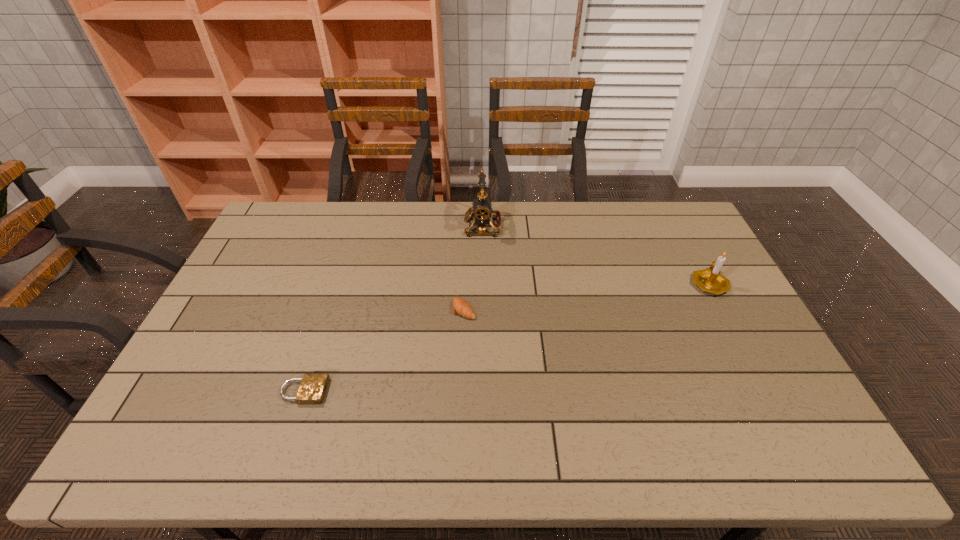
Where is `free space at the near left corner of the desktop`? The image size is (960, 540). free space at the near left corner of the desktop is located at coordinates (197, 443).

In order to click on free space at the near right corner in this screenshot , I will do `click(805, 455)`.

The image size is (960, 540). I want to click on free space between the crescent roll and the rightmost object, so click(587, 296).

Locate an element on the screen. This screenshot has height=540, width=960. free spot between the nearest object and the rightmost object is located at coordinates (507, 337).

Where is `vacant area that lies between the leftmost object and the crescent roll`? The image size is (960, 540). vacant area that lies between the leftmost object and the crescent roll is located at coordinates pyautogui.click(x=384, y=350).

You are a GUI agent. You are given a task and a screenshot of the screen. Output one action in this format:
    pyautogui.click(x=<x>, y=<y>)
    Task: Click on the vacant point located between the rightmost object and the third tallest object
    The image size is (960, 540).
    Given the screenshot: What is the action you would take?
    pyautogui.click(x=587, y=296)

At what (x,y) coordinates should I click in order to perform the action: click on free space between the farthest object and the third nearest object. Please return your answer as a coordinate pair (x, y). This screenshot has height=540, width=960. Looking at the image, I should click on (596, 254).

Where is `empty space between the telephone and the padlock`? empty space between the telephone and the padlock is located at coordinates (394, 308).

I want to click on unoccupied area between the candle holder and the leftmost object, so click(507, 337).

This screenshot has height=540, width=960. I want to click on unoccupied area between the second farthest object and the telephone, so click(x=596, y=254).